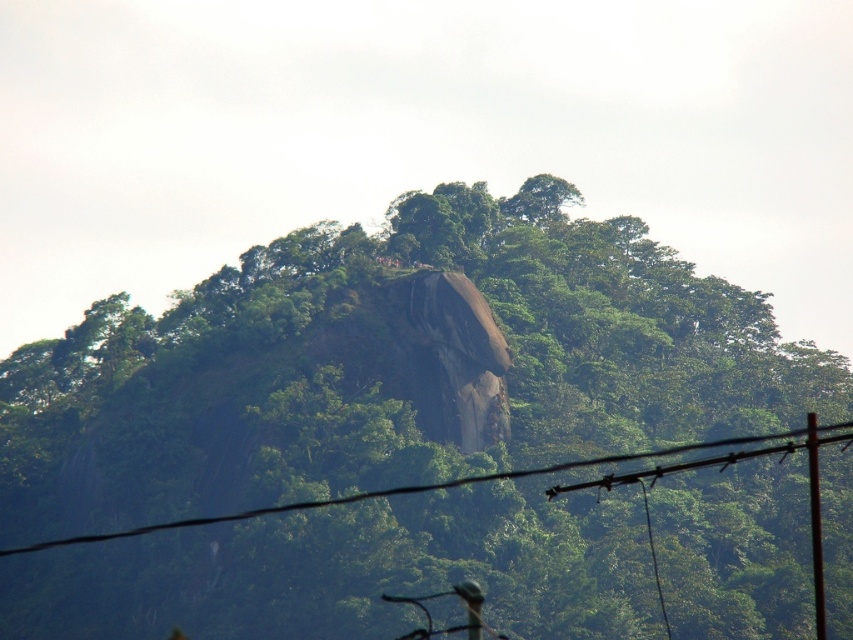
You are standing at the point with coordinates point (260, 508) and want to walk towards the large, prominent rock formation at the center of the hilltop. Will the point with coordinates point (165, 362) block your path?

Point (165, 362) is behind point (260, 508), so it will not block your path to the large, prominent rock formation at the center of the hilltop.

You are standing at the bottom of the hill and see the green leafy tree at center. Based on its position coordinates, can you determine if the tree is closer to the top or the bottom of the hill?

The green leafy tree at center is located at point (x=393, y=364), which places it closer to the bottom of the hill since the y coordinate 0.462 is less than 0.5.